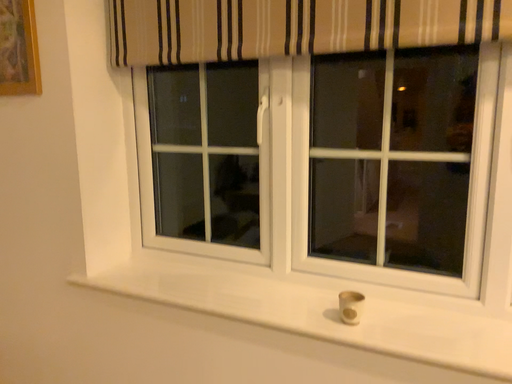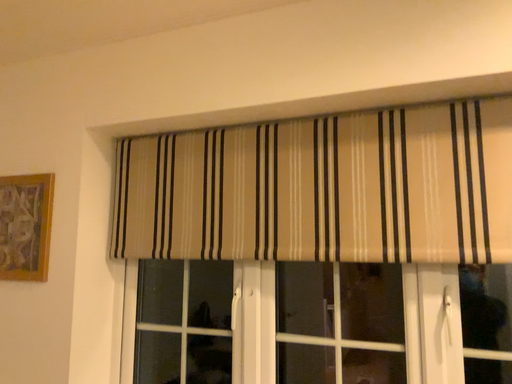
Question: Which way did the camera rotate in the video?

Choices:
 (A) rotated upward
 (B) rotated downward

Answer: (A)